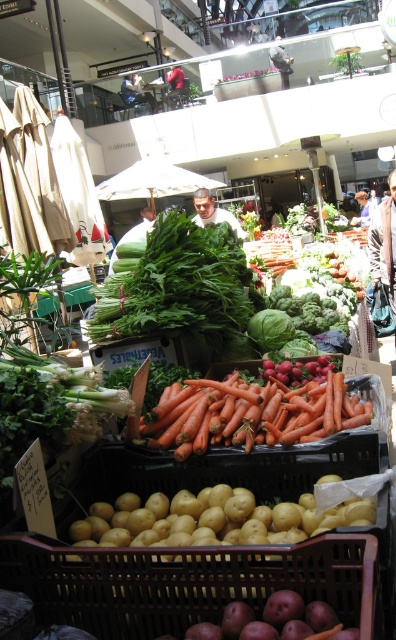
The image size is (396, 640). Identify the location of brown woven basket at lower center. (188, 582).

Is orange smooth carrots at center to the left of red fabric jacket at center from the viewer's perspective?

In fact, orange smooth carrots at center is to the right of red fabric jacket at center.

Can you confirm if orange smooth carrots at center is smaller than red fabric jacket at center?

Correct, orange smooth carrots at center occupies less space than red fabric jacket at center.

Between point (331, 388) and point (186, 96), which one is positioned in front?

Positioned in front is point (331, 388).

Locate an element on the screen. orange smooth carrots at center is located at coordinates (251, 413).

Which is behind, point (253, 307) or point (173, 84)?

Point (173, 84)

Which is more to the right, green leafy at center or red fabric jacket at center?

green leafy at center

Who is more forward, (234, 257) or (169, 77)?

Point (234, 257)

Locate an element on the screen. The height and width of the screenshot is (640, 396). green leafy at center is located at coordinates (177, 284).